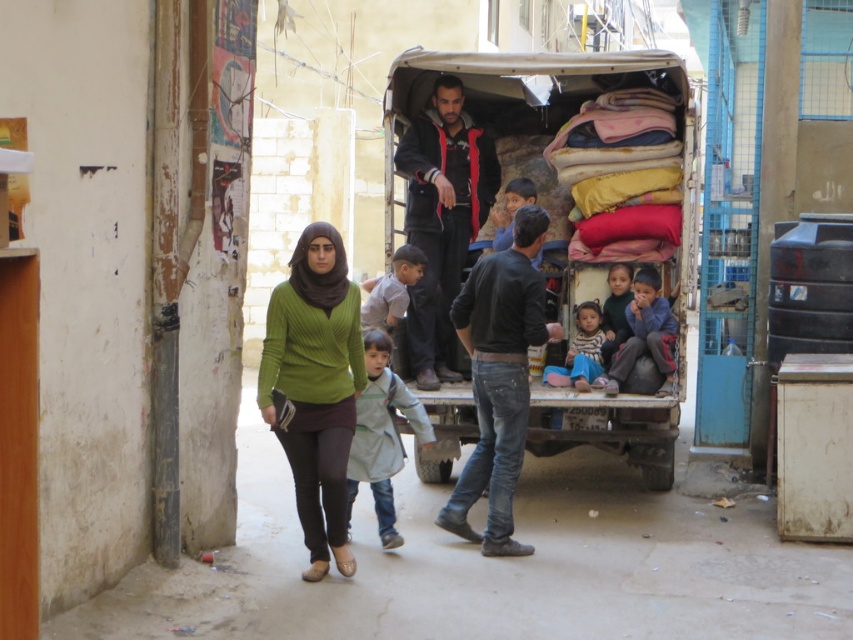
You are a delivery person who needs to hand out a package to someone in the alley. You see the green ribbed sweater at center and the light gray fabric jacket at center. How far apart are these two items?

The green ribbed sweater at center is 23.33 inches away from the light gray fabric jacket at center.

You are standing in the alleyway and need to reach the blue metal gate on the right wall. There is a textured fabric cart at center blocking your path. Can you walk around the cart to reach the gate?

Yes, you can walk around the textured fabric cart at center to reach the blue metal gate on the right wall since it is positioned at the center of the alleyway, allowing space on either side.